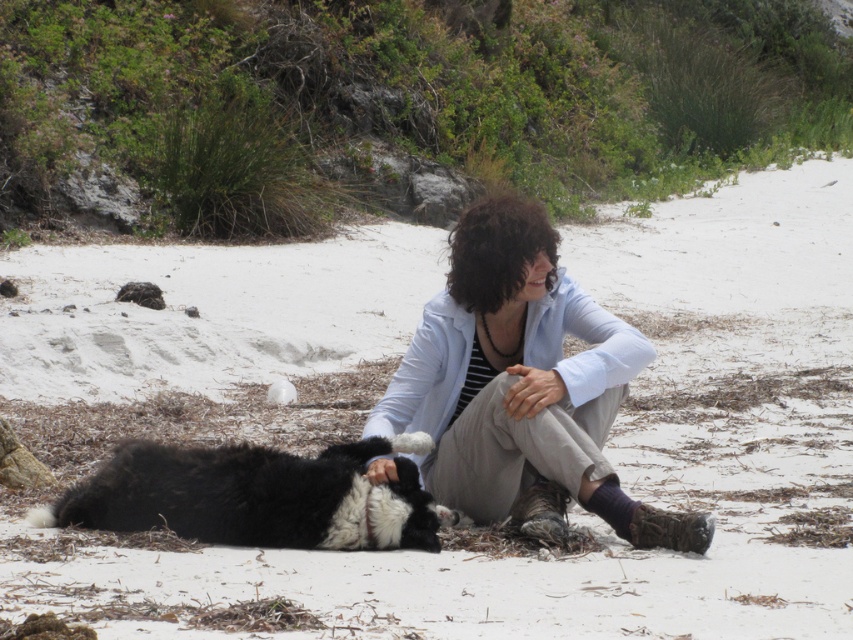
Question: Is light blue fabric jacket at center closer to the viewer compared to black fluffy dog at lower left?

Choices:
 (A) no
 (B) yes

Answer: (B)

Question: Among these points, which one is nearest to the camera?

Choices:
 (A) (428, 346)
 (B) (144, 490)

Answer: (B)

Question: Is light blue fabric jacket at center behind black fluffy dog at lower left?

Choices:
 (A) no
 (B) yes

Answer: (A)

Question: Which point is closer to the camera?

Choices:
 (A) (408, 365)
 (B) (223, 512)

Answer: (B)

Question: Is light blue fabric jacket at center smaller than black fluffy dog at lower left?

Choices:
 (A) yes
 (B) no

Answer: (B)